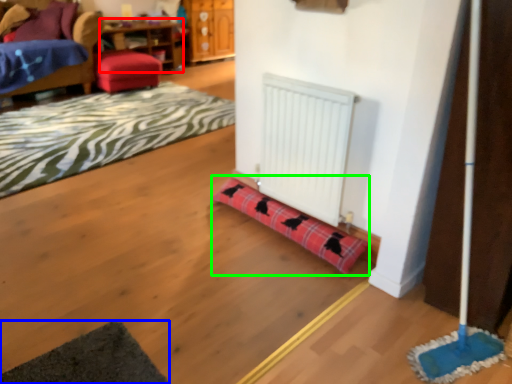
Question: Based on their relative distances, which object is farther from table (highlighted by a red box)? Choose from yoga mat (highlighted by a blue box) and plaid (highlighted by a green box).

Choices:
 (A) yoga mat
 (B) plaid

Answer: (A)